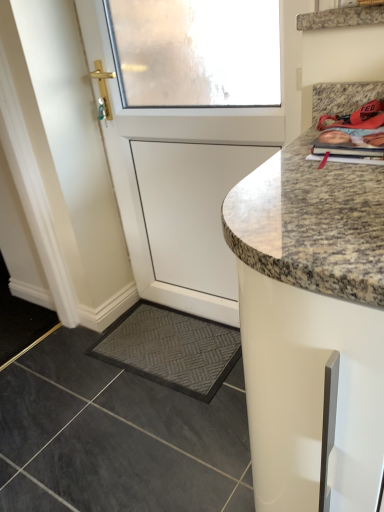
Question: Is granite shelf at upper right in front of or behind dark gray textured mat at lower left in the image?

Choices:
 (A) front
 (B) behind

Answer: (A)

Question: Considering the positions of point (370, 16) and point (192, 382), is point (370, 16) closer or farther from the camera than point (192, 382)?

Choices:
 (A) closer
 (B) farther

Answer: (A)

Question: Which of these objects is positioned farthest from the granite shelf at upper right?

Choices:
 (A) dark gray textured mat at lower left
 (B) white matte door at upper left
 (C) granite at lower right
 (D) matte orange magazine at upper right

Answer: (C)

Question: Estimate the real-world distances between objects in this image. Which object is farther from the granite at lower right?

Choices:
 (A) granite shelf at upper right
 (B) matte orange magazine at upper right
 (C) white matte door at upper left
 (D) dark gray textured mat at lower left

Answer: (A)